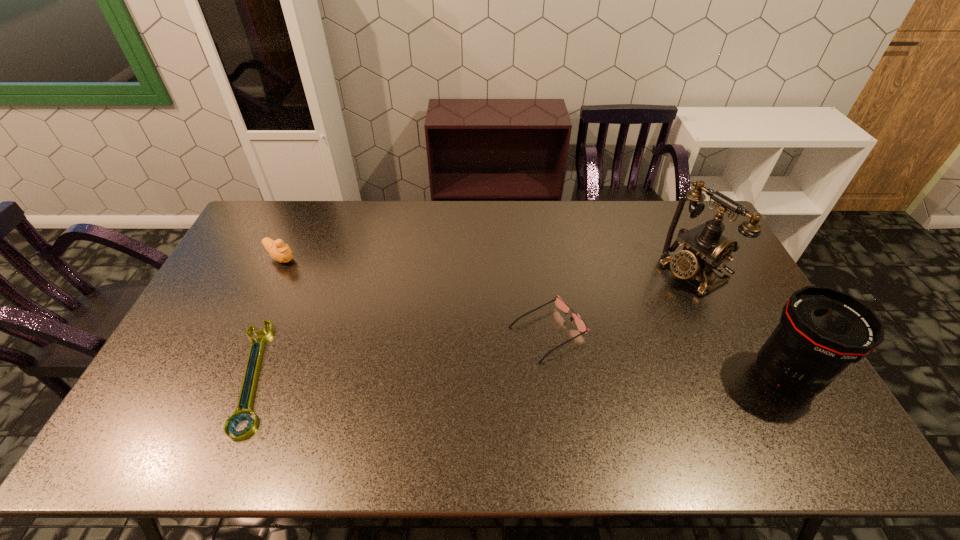
Locate an element on the screen. the shortest object is located at coordinates coord(238,415).

You are a GUI agent. You are given a task and a screenshot of the screen. Output one action in this format:
    pyautogui.click(x=<x>, y=<y>)
    Task: Click on the fourth shortest object
    The height and width of the screenshot is (540, 960).
    Given the screenshot: What is the action you would take?
    pyautogui.click(x=822, y=330)

This screenshot has height=540, width=960. Identify the location of sunglasses. (560, 304).

You are a GUI agent. You are given a task and a screenshot of the screen. Output one action in this format:
    pyautogui.click(x=<x>, y=<y>)
    Task: Click on the second shortest object
    
    Given the screenshot: What is the action you would take?
    pyautogui.click(x=560, y=304)

Find the location of a particular element. The height and width of the screenshot is (540, 960). duckling is located at coordinates (281, 252).

Find the location of a particular element. The image size is (960, 540). telephone is located at coordinates (704, 248).

I want to click on vacant position located 0.250m on the right of the wrench, so click(x=370, y=375).

The width and height of the screenshot is (960, 540). I want to click on vacant region located 0.350m on the back of the second tallest object, so pyautogui.click(x=720, y=264).

Locate an element on the screen. The height and width of the screenshot is (540, 960). vacant space located on the bridge of the sunglasses is located at coordinates (430, 393).

Locate an element on the screen. vacant space situated on the bridge of the sunglasses is located at coordinates (437, 390).